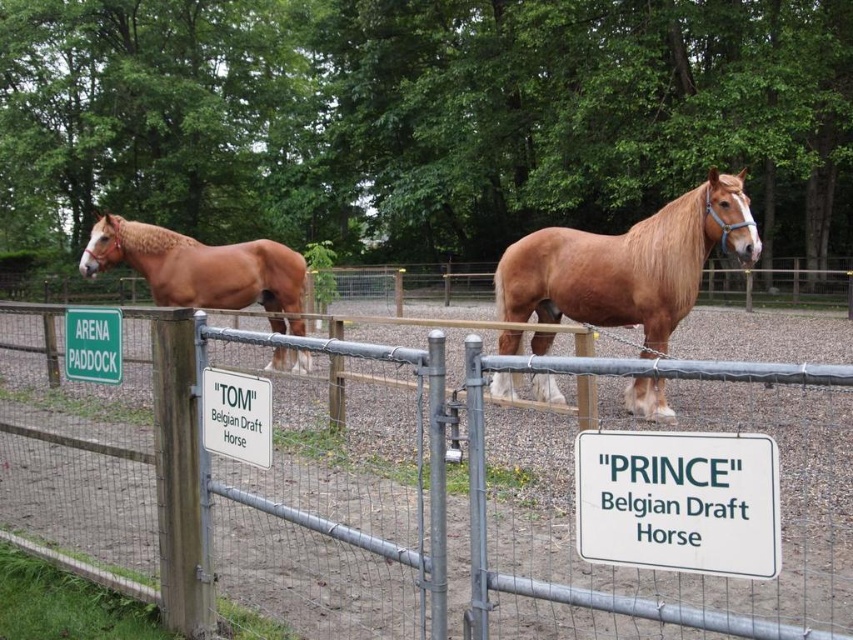
Question: Does white plastic sign at center appear on the right side of green plastic sign at upper left?

Choices:
 (A) yes
 (B) no

Answer: (A)

Question: Which of the following is the farthest from the observer?

Choices:
 (A) metal fence at center
 (B) green plastic sign at upper left
 (C) golden brown mane at center

Answer: (C)

Question: Is metal fence at center positioned before golden brown horse at left?

Choices:
 (A) yes
 (B) no

Answer: (A)

Question: Estimate the real-world distances between objects in this image. Which object is closer to the green plastic sign at upper left?

Choices:
 (A) white plastic sign at center
 (B) white paper sign at center
 (C) golden brown mane at center
 (D) metal fence at center

Answer: (A)

Question: Does metal fence at center appear over green plastic sign at upper left?

Choices:
 (A) no
 (B) yes

Answer: (A)

Question: Which point is farther from the camera taking this photo?

Choices:
 (A) (712, 532)
 (B) (697, 291)
 (C) (262, 444)

Answer: (B)